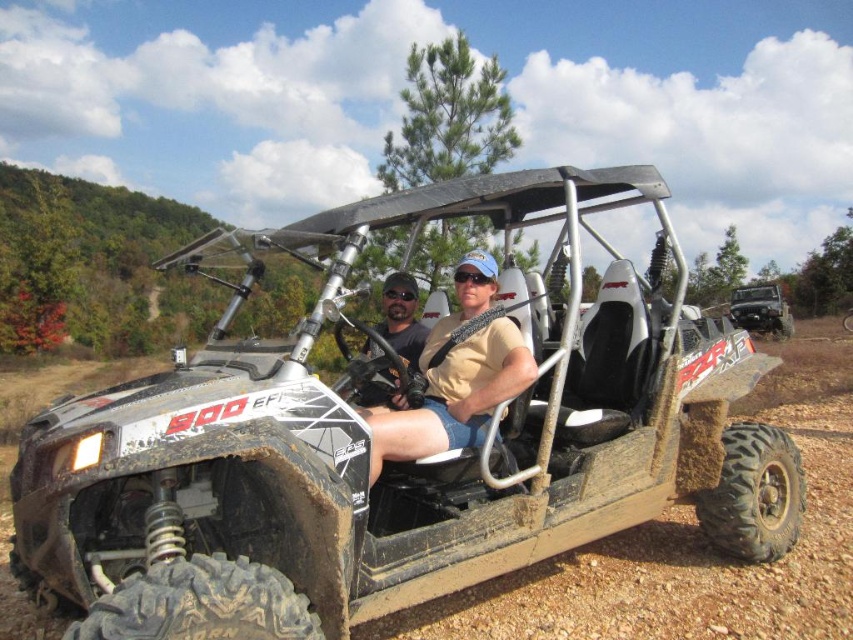
Question: Can you confirm if matte black golf cart at center is wider than brushed metal jeep at center?

Choices:
 (A) yes
 (B) no

Answer: (A)

Question: Considering the real-world distances, which object is farthest from the brushed metal jeep at center?

Choices:
 (A) tan fabric shirt at center
 (B) matte black golf cart at center

Answer: (A)

Question: Is matte black golf cart at center positioned in front of tan fabric shirt at center?

Choices:
 (A) no
 (B) yes

Answer: (B)

Question: Which object appears closest to the camera in this image?

Choices:
 (A) matte black helmet at center
 (B) matte black golf cart at center
 (C) tan fabric shirt at center
 (D) brushed metal jeep at center

Answer: (B)

Question: Which object is closer to the camera taking this photo?

Choices:
 (A) matte black helmet at center
 (B) brushed metal jeep at center
 (C) matte black golf cart at center

Answer: (C)

Question: Is matte black golf cart at center below matte black helmet at center?

Choices:
 (A) no
 (B) yes

Answer: (B)